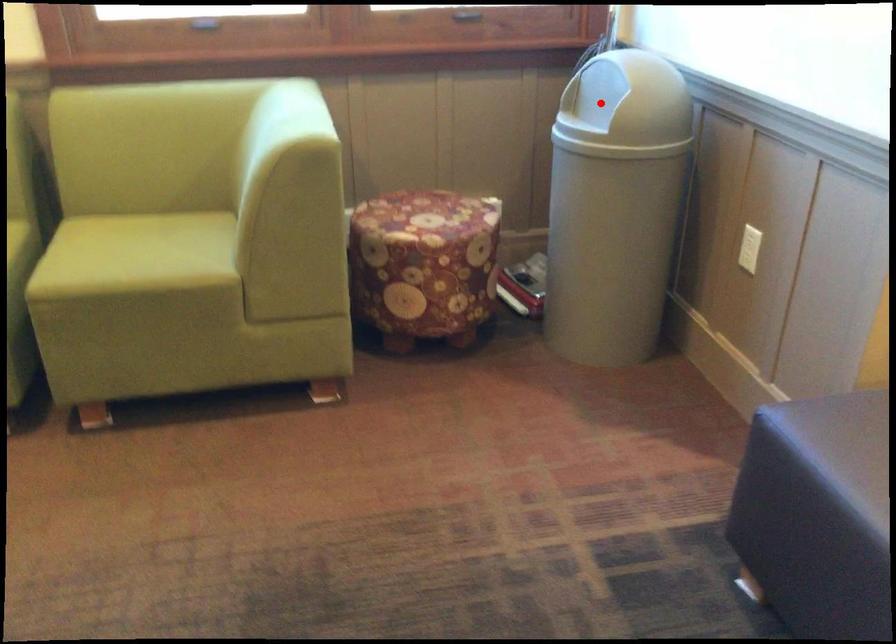
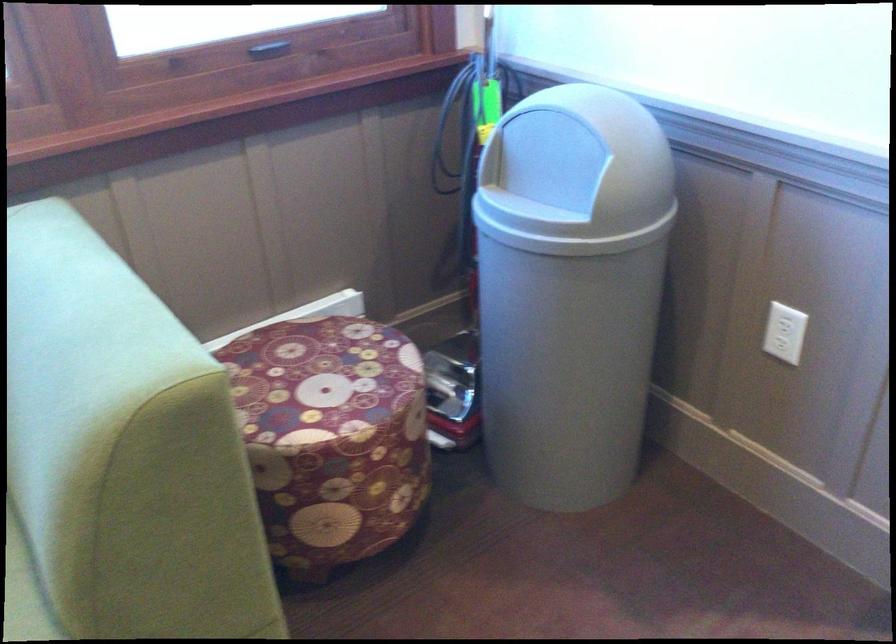
Question: I am providing you with two images of the same scene from different viewpoints. Given a red point in image1, look at the same physical point in image2. Is it:

Choices:
 (A) Closer to the viewpoint
 (B) Farther from the viewpoint

Answer: (A)